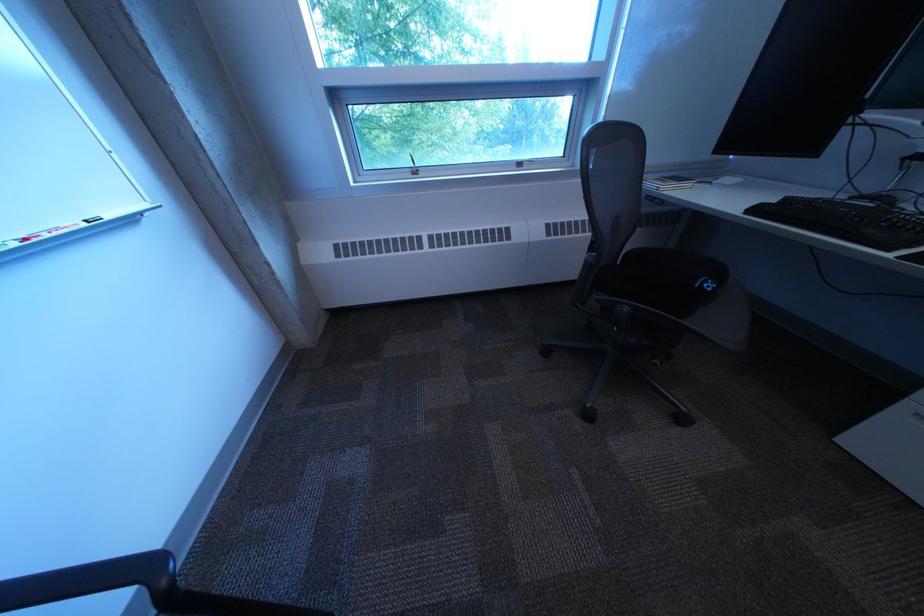
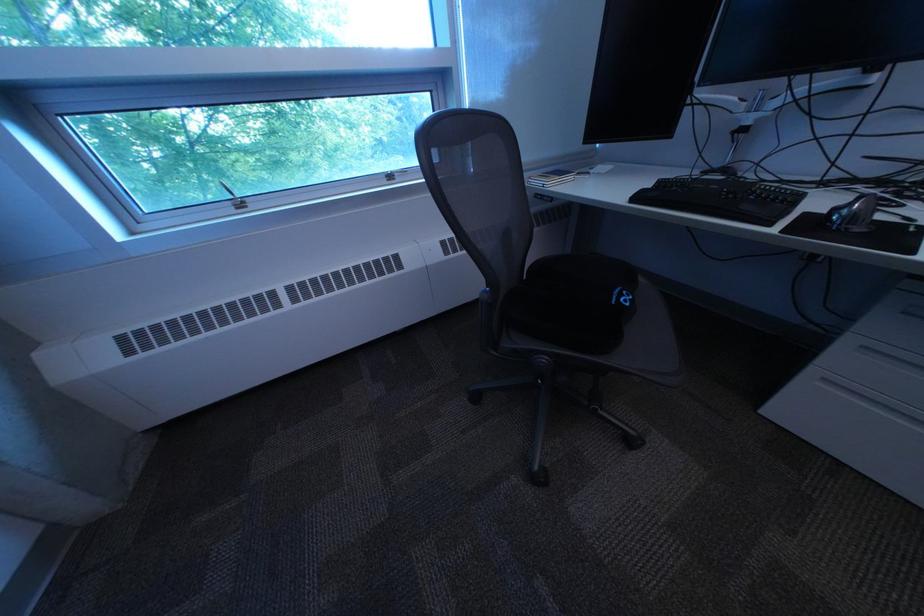
Question: The camera is either moving clockwise (left) or counter-clockwise (right) around the object. The first image is from the beginning of the video and the second image is from the end. Is the camera moving left or right when shooting the video?

Choices:
 (A) Left
 (B) Right

Answer: (A)